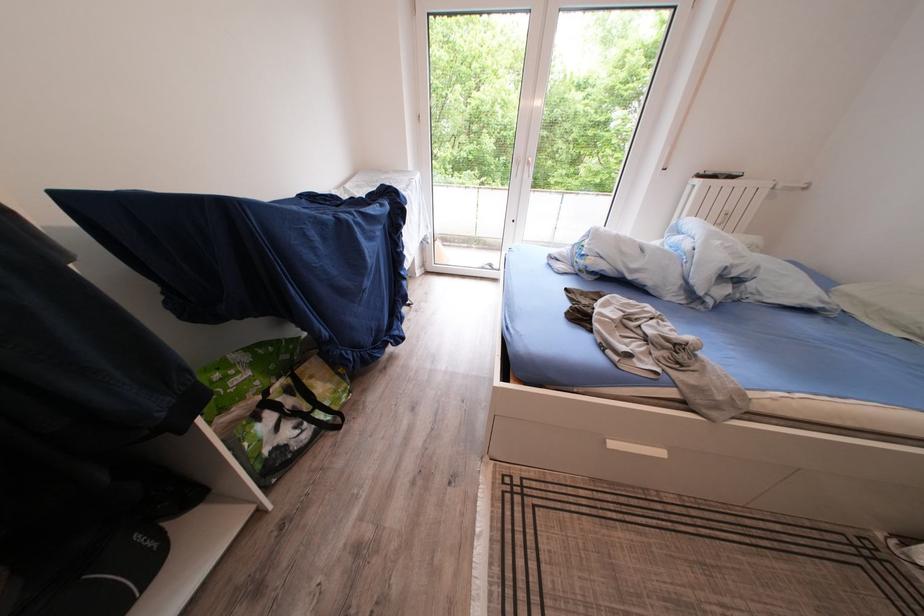
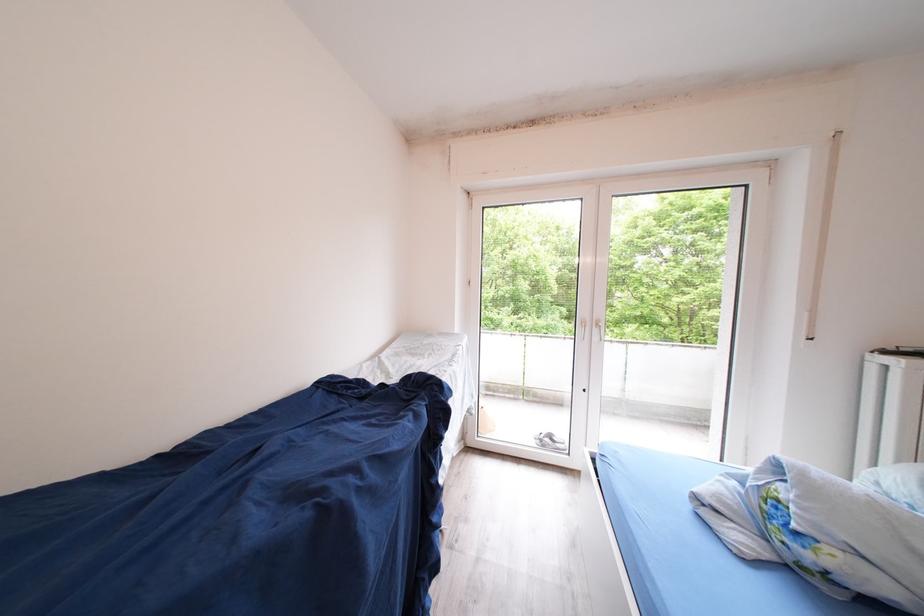
The images are taken continuously from a first-person perspective. In which direction are you moving?

The movement direction of the cameraman is left, forward.